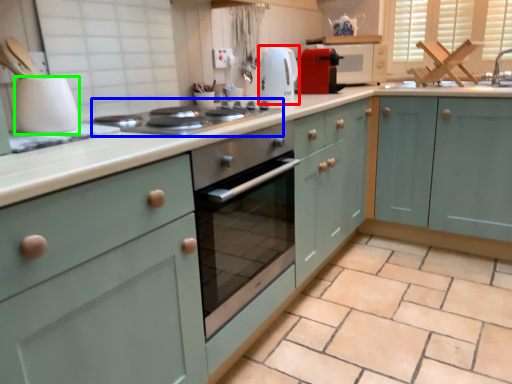
Question: Which object is positioned farthest from kitchen appliance (highlighted by a red box)? Select from home appliance (highlighted by a blue box) and kitchen appliance (highlighted by a green box).

Choices:
 (A) home appliance
 (B) kitchen appliance

Answer: (B)